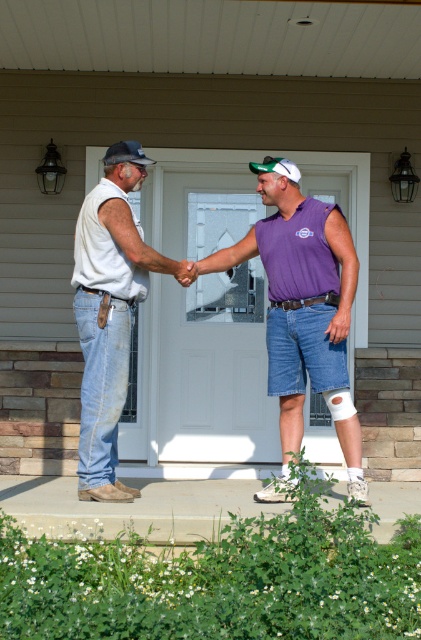
Question: Which object appears closest to the camera in this image?

Choices:
 (A) purple fabric sleeveless shirt at center
 (B) denim jeans at left

Answer: (A)

Question: Which point appears closest to the camera in this image?

Choices:
 (A) (261, 248)
 (B) (95, 499)

Answer: (B)

Question: Estimate the real-world distances between objects in this image. Which object is closer to the white matte bandage at lower center?

Choices:
 (A) purple fabric sleeveless shirt at center
 (B) denim jeans at left

Answer: (A)

Question: Does purple fabric sleeveless shirt at center have a larger size compared to white matte bandage at lower center?

Choices:
 (A) no
 (B) yes

Answer: (B)

Question: Can you confirm if purple fabric sleeveless shirt at center is smaller than denim jeans at left?

Choices:
 (A) no
 (B) yes

Answer: (A)

Question: Is purple fabric sleeveless shirt at center bigger than white matte bandage at lower center?

Choices:
 (A) yes
 (B) no

Answer: (A)